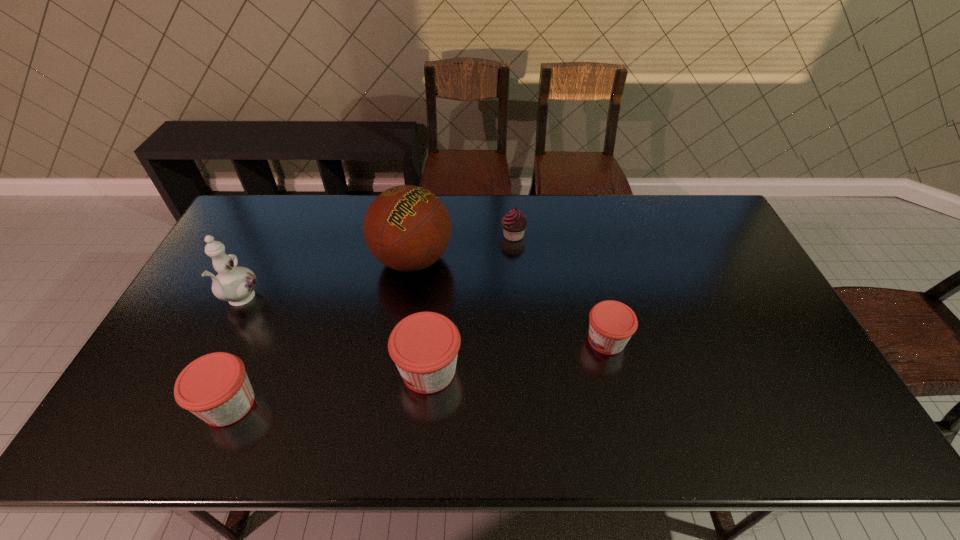
In order to click on cupcake at the far edge in this screenshot , I will do `click(514, 223)`.

The height and width of the screenshot is (540, 960). I want to click on object present at the left edge, so click(x=235, y=284).

Locate an element on the screen. free space at the far edge is located at coordinates (620, 231).

In the image, there is a desktop. At what (x,y) coordinates should I click in order to perform the action: click on vacant region at the near edge. Please return your answer as a coordinate pair (x, y). Image resolution: width=960 pixels, height=540 pixels. Looking at the image, I should click on (472, 405).

Identify the location of free space at the right edge. The width and height of the screenshot is (960, 540). (736, 327).

In the image, there is a desktop. Identify the location of free space at the far left corner. The width and height of the screenshot is (960, 540). (279, 200).

Where is `free space at the near left corner`? free space at the near left corner is located at coordinates (132, 393).

The height and width of the screenshot is (540, 960). Find the location of `vacant region between the chinaware and the leftmost jam`. vacant region between the chinaware and the leftmost jam is located at coordinates (234, 352).

Identify the location of free space between the cupcake and the chinaware. The width and height of the screenshot is (960, 540). (376, 268).

The image size is (960, 540). I want to click on vacant space in between the basketball and the leftmost jam, so click(321, 332).